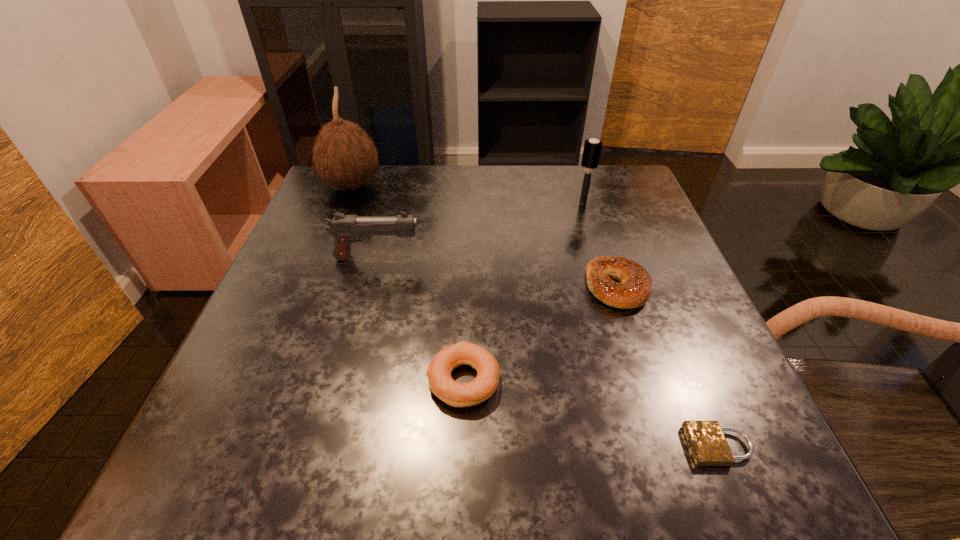
In order to click on vacant space located 0.330m on the surface of the tallest object in this screenshot , I will do `click(513, 186)`.

This screenshot has height=540, width=960. Identify the location of vacant area situated on the left of the second tallest object. (410, 203).

You are a GUI agent. You are given a task and a screenshot of the screen. Output one action in this format:
    pyautogui.click(x=<x>, y=<y>)
    Task: Click on the free space located 0.210m in the direction the fourth shortest object is aimed
    The image size is (960, 540).
    Given the screenshot: What is the action you would take?
    pyautogui.click(x=521, y=258)

I want to click on free space located 0.050m on the left of the right bagel, so click(562, 286).

Identify the location of vacant space situated 0.200m on the left of the nearer bagel. The height and width of the screenshot is (540, 960). (x=302, y=380).

The width and height of the screenshot is (960, 540). I want to click on blank area located on the keyhole side of the nearest object, so click(x=596, y=446).

Identify the location of vacant space located on the keyhole side of the nearest object. The height and width of the screenshot is (540, 960). (568, 446).

In order to click on vacant space located 0.330m on the keyhole side of the nearest object in this screenshot , I will do `click(456, 446)`.

Where is `coconut located in the far edge section of the desktop`? This screenshot has height=540, width=960. coconut located in the far edge section of the desktop is located at coordinates (344, 155).

The height and width of the screenshot is (540, 960). What are the coordinates of `hairbrush positioned at the far edge` in the screenshot? It's located at (592, 148).